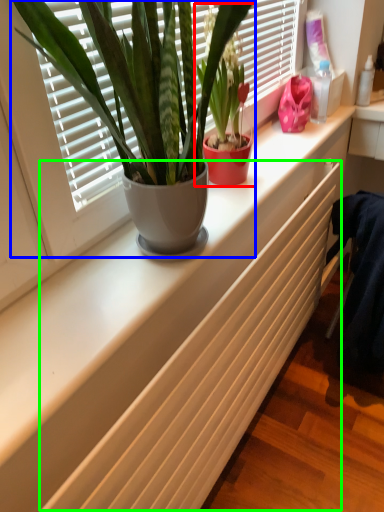
Question: Which object is positioned farthest from houseplant (highlighted by a red box)? Select from houseplant (highlighted by a blue box) and radiator (highlighted by a green box).

Choices:
 (A) houseplant
 (B) radiator

Answer: (B)